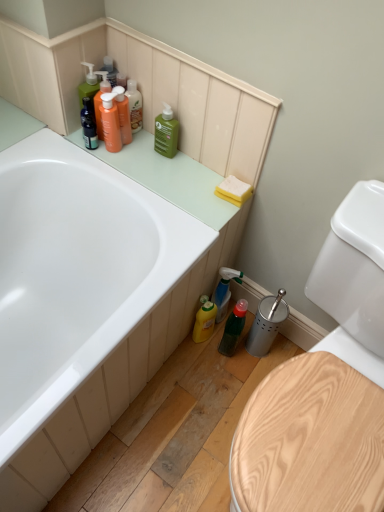
Find the location of `free space to the left of translucent orange bottles at upper left, arranged as the 1th toiletry when ordered from the bottom`. free space to the left of translucent orange bottles at upper left, arranged as the 1th toiletry when ordered from the bottom is located at coordinates (65, 146).